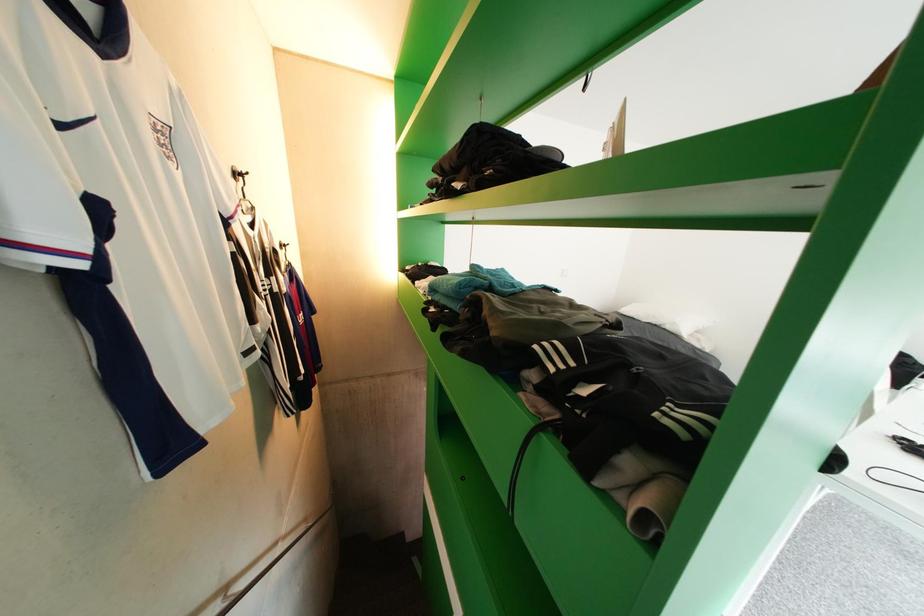
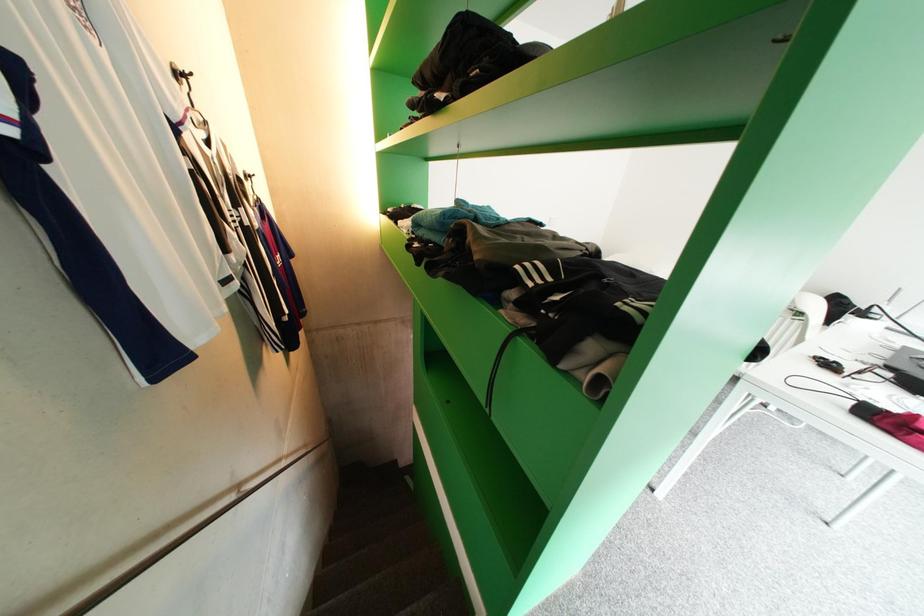
Question: Based on the continuous images, in which direction is the camera rotating? Reply with the corresponding letter.

Choices:
 (A) Left
 (B) Right
 (C) Up
 (D) Down

Answer: (D)